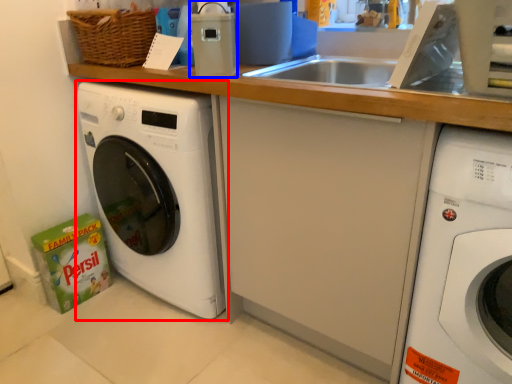
Question: Which point is further to the camera, washing machine (highlighted by a red box) or appliance (highlighted by a blue box)?

Choices:
 (A) washing machine
 (B) appliance

Answer: (A)